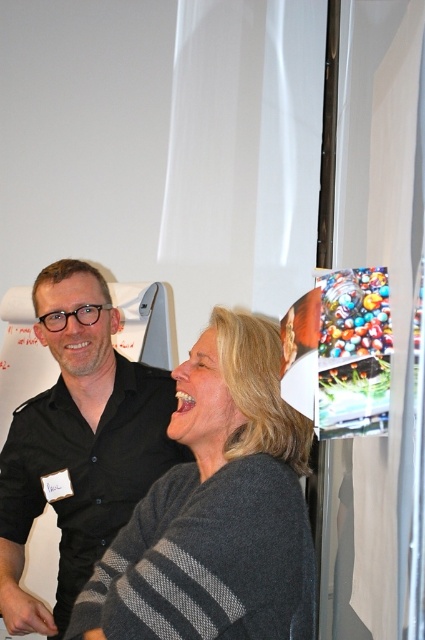
From the picture: In the scene, you see a gray striped sweater at center and a black matte shirt at upper left. Which object is positioned to the right of the other?

The gray striped sweater at center is to the right of the black matte shirt at upper left.

You are organizing a clothing donation drive and need to sort items by size. You have a gray striped sweater at center and a black matte shirt at upper left. Which item should you place in the small size bin?

The gray striped sweater at center is smaller than the black matte shirt at upper left, so it should be placed in the small size bin.